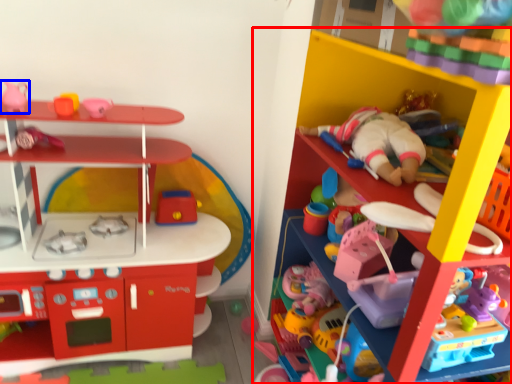
Question: Which object appears closest to the camera in this image, shelf (highlighted by a red box) or toy (highlighted by a blue box)?

Choices:
 (A) shelf
 (B) toy

Answer: (A)